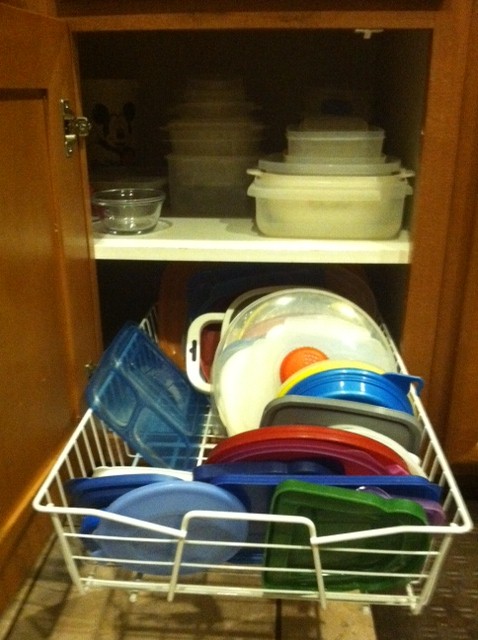
At what (x,y) coordinates should I click in order to perform the action: click on shelf. Please return your answer as a coordinate pair (x, y). The image size is (478, 640). Looking at the image, I should click on (192, 256).